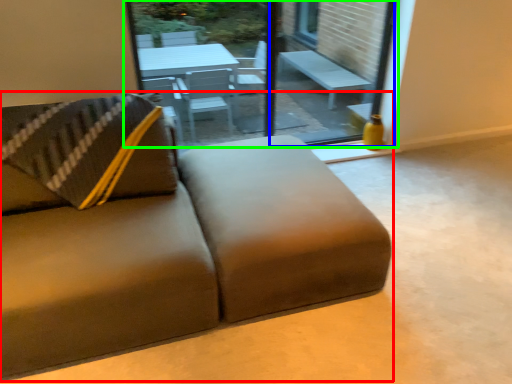
Question: Considering the real-world distances, which object is closest to studio couch (highlighted by a red box)? window screen (highlighted by a blue box) or window (highlighted by a green box).

Choices:
 (A) window screen
 (B) window

Answer: (B)